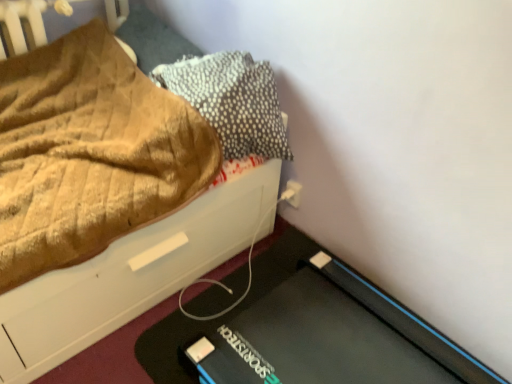
What is the approximate height of brown textured pillow at upper left, placed as the 2th pillow when sorted from right to left?

brown textured pillow at upper left, placed as the 2th pillow when sorted from right to left, is 18.91 centimeters tall.

This screenshot has width=512, height=384. Describe the element at coordinates (292, 193) in the screenshot. I see `white plastic electric outlet at lower right` at that location.

This screenshot has width=512, height=384. I want to click on textured gray pillow at upper right, which is the second pillow from left to right, so click(x=231, y=101).

Is brown textured fabric at upper left facing towards brown textured pillow at upper left, placed as the 2th pillow when sorted from right to left?

No, brown textured fabric at upper left is not turned towards brown textured pillow at upper left, placed as the 2th pillow when sorted from right to left.

Who is more distant, brown textured fabric at upper left or brown textured pillow at upper left, positioned as the 1th pillow in left-to-right order?

brown textured pillow at upper left, positioned as the 1th pillow in left-to-right order, is behind.

How distant is brown textured fabric at upper left from brown textured pillow at upper left, positioned as the 1th pillow in left-to-right order?

The distance of brown textured fabric at upper left from brown textured pillow at upper left, positioned as the 1th pillow in left-to-right order, is 29.05 inches.

Would you say textured gray pillow at upper right, which is the second pillow from left to right, is outside white plastic electric outlet at lower right?

Indeed, textured gray pillow at upper right, which is the second pillow from left to right, is completely outside white plastic electric outlet at lower right.

Where is `the 1st pillow counting from the left side of the white plastic electric outlet at lower right`? the 1st pillow counting from the left side of the white plastic electric outlet at lower right is located at coordinates (231, 101).

From the image's perspective, is textured gray pillow at upper right, acting as the first pillow starting from the right, above or below white plastic electric outlet at lower right?

Based on their image positions, textured gray pillow at upper right, acting as the first pillow starting from the right, is located above white plastic electric outlet at lower right.

Considering the sizes of objects textured gray pillow at upper right, acting as the first pillow starting from the right, and white plastic electric outlet at lower right in the image provided, who is wider, textured gray pillow at upper right, acting as the first pillow starting from the right, or white plastic electric outlet at lower right?

Wider between the two is textured gray pillow at upper right, acting as the first pillow starting from the right.

Is white plastic electric outlet at lower right at the back of brown textured pillow at upper left, placed as the 2th pillow when sorted from right to left?

brown textured pillow at upper left, placed as the 2th pillow when sorted from right to left, does not have its back to white plastic electric outlet at lower right.

Where is `the 2nd pillow above the white plastic electric outlet at lower right (from a real-world perspective)`? the 2nd pillow above the white plastic electric outlet at lower right (from a real-world perspective) is located at coordinates [x=153, y=39].

From a real-world perspective, which is physically above, brown textured pillow at upper left, positioned as the 1th pillow in left-to-right order, or white plastic electric outlet at lower right?

brown textured pillow at upper left, positioned as the 1th pillow in left-to-right order, from a real-world perspective.

Which of these two, brown textured pillow at upper left, placed as the 2th pillow when sorted from right to left, or white plastic electric outlet at lower right, is wider?

brown textured pillow at upper left, placed as the 2th pillow when sorted from right to left.

Considering the sizes of objects white plastic electric outlet at lower right and brown textured fabric at upper left in the image provided, who is smaller, white plastic electric outlet at lower right or brown textured fabric at upper left?

white plastic electric outlet at lower right.

From a real-world perspective, between white plastic electric outlet at lower right and brown textured fabric at upper left, who is vertically higher?

In real-world perspective, brown textured fabric at upper left is above.

Relative to brown textured fabric at upper left, is white plastic electric outlet at lower right in front or behind?

white plastic electric outlet at lower right is positioned farther from the viewer than brown textured fabric at upper left.

Could you tell me if white plastic electric outlet at lower right is facing brown textured fabric at upper left?

Yes, white plastic electric outlet at lower right faces towards brown textured fabric at upper left.

This screenshot has height=384, width=512. Identify the location of bed in front of the textured gray pillow at upper right, which is the second pillow from left to right. (130, 274).

Choose the correct answer: Is textured gray pillow at upper right, which is the second pillow from left to right, inside brown textured fabric at upper left or outside it?

textured gray pillow at upper right, which is the second pillow from left to right, exists entirely within brown textured fabric at upper left.

From a real-world perspective, does textured gray pillow at upper right, acting as the first pillow starting from the right, sit lower than brown textured fabric at upper left?

No, from a real-world perspective, textured gray pillow at upper right, acting as the first pillow starting from the right, is not below brown textured fabric at upper left.

In terms of height, does textured gray pillow at upper right, acting as the first pillow starting from the right, look taller or shorter compared to brown textured fabric at upper left?

textured gray pillow at upper right, acting as the first pillow starting from the right, is shorter than brown textured fabric at upper left.

How different are the orientations of brown textured fabric at upper left and textured gray pillow at upper right, acting as the first pillow starting from the right, in degrees?

90 degrees separate the facing orientations of brown textured fabric at upper left and textured gray pillow at upper right, acting as the first pillow starting from the right.

Can you confirm if brown textured fabric at upper left is shorter than textured gray pillow at upper right, acting as the first pillow starting from the right?

No.

Is brown textured fabric at upper left outside of textured gray pillow at upper right, which is the second pillow from left to right?

Yes, brown textured fabric at upper left is not within textured gray pillow at upper right, which is the second pillow from left to right.

Is the depth of brown textured fabric at upper left less than that of textured gray pillow at upper right, which is the second pillow from left to right?

Yes, it is in front of textured gray pillow at upper right, which is the second pillow from left to right.

Which is more to the left, textured gray pillow at upper right, which is the second pillow from left to right, or brown textured pillow at upper left, positioned as the 1th pillow in left-to-right order?

From the viewer's perspective, brown textured pillow at upper left, positioned as the 1th pillow in left-to-right order, appears more on the left side.

Which is less distant, (249, 68) or (138, 39)?

Point (249, 68) appears to be closer to the viewer than point (138, 39).

Considering the sizes of objects textured gray pillow at upper right, acting as the first pillow starting from the right, and brown textured pillow at upper left, placed as the 2th pillow when sorted from right to left, in the image provided, who is thinner, textured gray pillow at upper right, acting as the first pillow starting from the right, or brown textured pillow at upper left, placed as the 2th pillow when sorted from right to left,?

brown textured pillow at upper left, placed as the 2th pillow when sorted from right to left.

Between textured gray pillow at upper right, which is the second pillow from left to right, and brown textured pillow at upper left, placed as the 2th pillow when sorted from right to left, which one is positioned behind?

brown textured pillow at upper left, placed as the 2th pillow when sorted from right to left, is more distant.

Where is `bed below the brown textured pillow at upper left, positioned as the 1th pillow in left-to-right order (from the image's perspective)`? bed below the brown textured pillow at upper left, positioned as the 1th pillow in left-to-right order (from the image's perspective) is located at coordinates coord(130,274).

Find the location of a particular element. This screenshot has width=512, height=384. electric outlet below the textured gray pillow at upper right, which is the second pillow from left to right (from a real-world perspective) is located at coordinates (292, 193).

Which object lies further to the anchor point brown textured pillow at upper left, positioned as the 1th pillow in left-to-right order, textured gray pillow at upper right, acting as the first pillow starting from the right, or white plastic electric outlet at lower right?

white plastic electric outlet at lower right.

From the image, which object appears to be nearer to textured gray pillow at upper right, acting as the first pillow starting from the right, brown textured pillow at upper left, placed as the 2th pillow when sorted from right to left, or brown textured fabric at upper left?

The object closer to textured gray pillow at upper right, acting as the first pillow starting from the right, is brown textured fabric at upper left.

Looking at the image, which one is located closer to brown textured fabric at upper left, textured gray pillow at upper right, which is the second pillow from left to right, or white plastic electric outlet at lower right?

textured gray pillow at upper right, which is the second pillow from left to right, lies closer to brown textured fabric at upper left than the other object.

Looking at the image, which one is located closer to textured gray pillow at upper right, which is the second pillow from left to right, brown textured pillow at upper left, placed as the 2th pillow when sorted from right to left, or white plastic electric outlet at lower right?

Based on the image, brown textured pillow at upper left, placed as the 2th pillow when sorted from right to left, appears to be nearer to textured gray pillow at upper right, which is the second pillow from left to right.

From the image, which object appears to be nearer to white plastic electric outlet at lower right, brown textured pillow at upper left, positioned as the 1th pillow in left-to-right order, or textured gray pillow at upper right, which is the second pillow from left to right?

textured gray pillow at upper right, which is the second pillow from left to right, is positioned closer to the anchor white plastic electric outlet at lower right.

Based on their spatial positions, is brown textured pillow at upper left, placed as the 2th pillow when sorted from right to left, or textured gray pillow at upper right, which is the second pillow from left to right, closer to brown textured fabric at upper left?

textured gray pillow at upper right, which is the second pillow from left to right, is positioned closer to the anchor brown textured fabric at upper left.

Which object lies nearer to the anchor point brown textured fabric at upper left, brown textured pillow at upper left, positioned as the 1th pillow in left-to-right order, or white plastic electric outlet at lower right?

white plastic electric outlet at lower right is closer to brown textured fabric at upper left.

Based on their spatial positions, is textured gray pillow at upper right, acting as the first pillow starting from the right, or brown textured pillow at upper left, placed as the 2th pillow when sorted from right to left, closer to brown textured fabric at upper left?

textured gray pillow at upper right, acting as the first pillow starting from the right, is positioned closer to the anchor brown textured fabric at upper left.

Where is `pillow between brown textured pillow at upper left, placed as the 2th pillow when sorted from right to left, and white plastic electric outlet at lower right, in the vertical direction`? The image size is (512, 384). pillow between brown textured pillow at upper left, placed as the 2th pillow when sorted from right to left, and white plastic electric outlet at lower right, in the vertical direction is located at coordinates (231, 101).

Image resolution: width=512 pixels, height=384 pixels. What are the coordinates of `pillow located between brown textured fabric at upper left and brown textured pillow at upper left, positioned as the 1th pillow in left-to-right order, in the depth direction` in the screenshot? It's located at (231, 101).